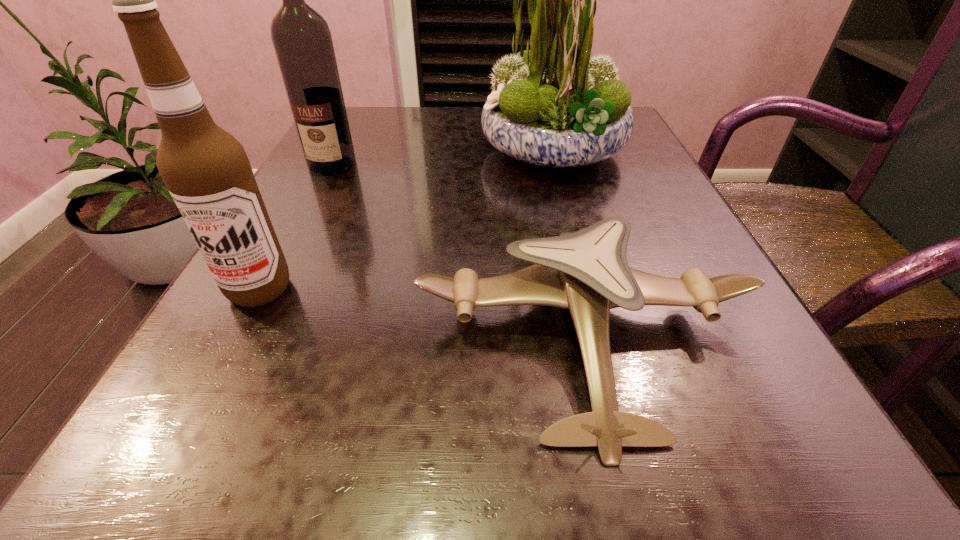
Where is `object that is at the near edge`? Image resolution: width=960 pixels, height=540 pixels. object that is at the near edge is located at coordinates (587, 272).

At what (x,y) coordinates should I click in order to perform the action: click on flower arrangement that is at the right edge. Please return your answer as a coordinate pair (x, y). This screenshot has width=960, height=540. Looking at the image, I should click on (553, 106).

At what (x,y) coordinates should I click in order to perform the action: click on drone that is at the right edge. Please return your answer as a coordinate pair (x, y). Image resolution: width=960 pixels, height=540 pixels. Looking at the image, I should click on (587, 272).

Find the location of a particular element. The height and width of the screenshot is (540, 960). object situated at the far right corner is located at coordinates (553, 106).

This screenshot has width=960, height=540. In order to click on object located in the near right corner section of the desktop in this screenshot , I will do `click(587, 272)`.

Image resolution: width=960 pixels, height=540 pixels. What are the coordinates of `vacant region at the far edge of the desktop` in the screenshot? It's located at (475, 128).

The image size is (960, 540). Find the location of `free region at the left edge of the desktop`. free region at the left edge of the desktop is located at coordinates (346, 194).

Identify the location of free space at the right edge. (766, 342).

Find the location of a particular element. vacant space at the near right corner is located at coordinates (729, 461).

Identify the location of free area in between the flower arrangement and the nearer alcohol. This screenshot has width=960, height=540. (407, 220).